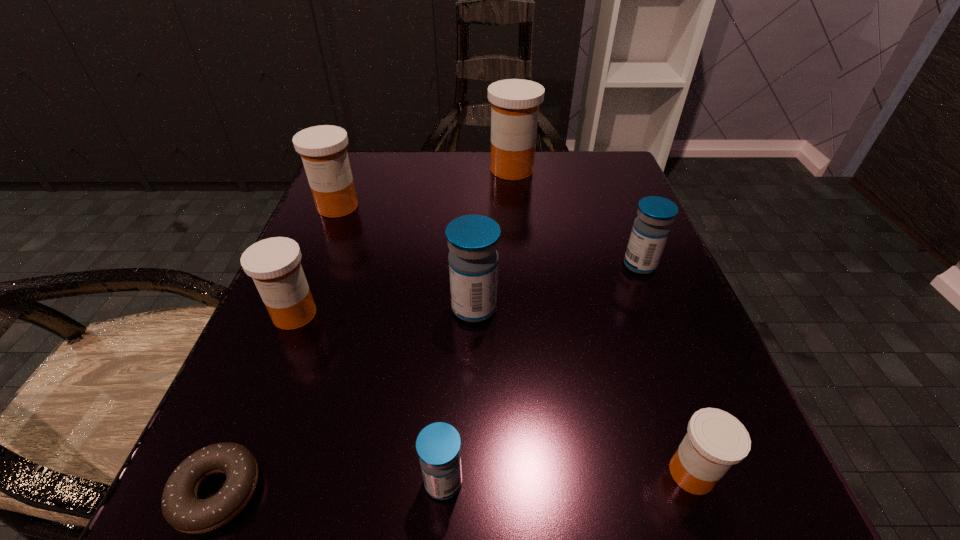
Where is `vacant space at the far edge`? vacant space at the far edge is located at coordinates (545, 168).

The image size is (960, 540). What are the coordinates of `vacant space at the near edge` in the screenshot? It's located at (339, 524).

Image resolution: width=960 pixels, height=540 pixels. I want to click on vacant region at the left edge of the desktop, so click(231, 402).

Locate an element on the screen. This screenshot has width=960, height=540. vacant space at the right edge of the desktop is located at coordinates (630, 330).

Locate an element on the screen. This screenshot has width=960, height=540. free location at the far left corner is located at coordinates (404, 152).

Where is `free region at the near left corner`? This screenshot has height=540, width=960. free region at the near left corner is located at coordinates coord(291,526).

The height and width of the screenshot is (540, 960). In the image, there is a desktop. Identify the location of blank space at the far right corner. (559, 161).

Locate an element on the screen. The width and height of the screenshot is (960, 540). vacant space at the near right corner is located at coordinates (751, 470).

Find the location of a particular element. Image resolution: width=960 pixels, height=540 pixels. vacant area that lies between the third farthest orange medicine and the smallest blue medicine is located at coordinates (369, 398).

Image resolution: width=960 pixels, height=540 pixels. Identify the location of unoccupied position between the tallest medicine and the third farthest orange medicine. (403, 242).